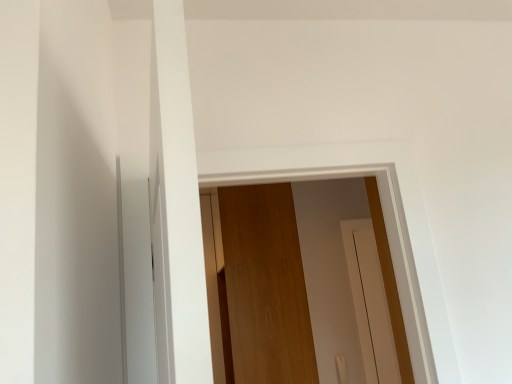
Question: From the image's perspective, would you say wooden door at center is shown under wooden screen door at center?

Choices:
 (A) no
 (B) yes

Answer: (A)

Question: From a real-world perspective, is wooden door at center below wooden screen door at center?

Choices:
 (A) yes
 (B) no

Answer: (B)

Question: From a real-world perspective, is wooden door at center positioned over wooden screen door at center based on gravity?

Choices:
 (A) yes
 (B) no

Answer: (A)

Question: Is wooden door at center not close to wooden screen door at center?

Choices:
 (A) yes
 (B) no

Answer: (B)

Question: Is wooden door at center wider than wooden screen door at center?

Choices:
 (A) yes
 (B) no

Answer: (A)

Question: Is wooden door at center oriented towards wooden screen door at center?

Choices:
 (A) no
 (B) yes

Answer: (A)

Question: Does wooden screen door at center come behind wooden door at center?

Choices:
 (A) yes
 (B) no

Answer: (A)

Question: Is wooden screen door at center at the left side of wooden door at center?

Choices:
 (A) yes
 (B) no

Answer: (B)

Question: Does wooden screen door at center have a lesser width compared to wooden door at center?

Choices:
 (A) no
 (B) yes

Answer: (B)

Question: Is wooden screen door at center taller than wooden door at center?

Choices:
 (A) yes
 (B) no

Answer: (B)

Question: Does wooden screen door at center have a greater width compared to wooden door at center?

Choices:
 (A) no
 (B) yes

Answer: (A)

Question: From the image's perspective, is wooden screen door at center above wooden door at center?

Choices:
 (A) no
 (B) yes

Answer: (A)

Question: Does point (359, 218) appear closer or farther from the camera than point (290, 370)?

Choices:
 (A) farther
 (B) closer

Answer: (A)